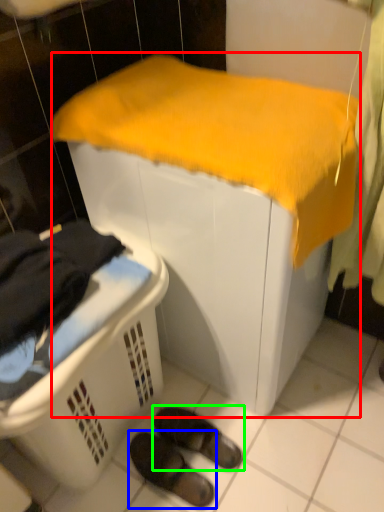
Question: Which object is positioned farthest from furniture (highlighted by a red box)? Select from footwear (highlighted by a blue box) and footwear (highlighted by a green box).

Choices:
 (A) footwear
 (B) footwear

Answer: (A)